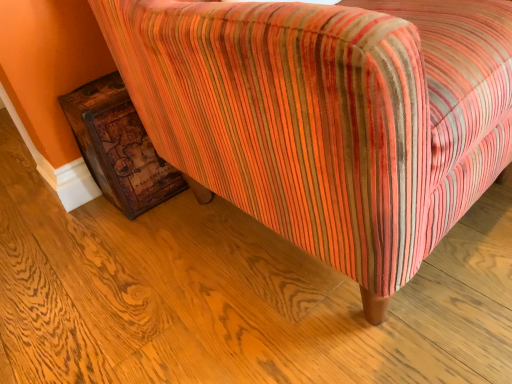
Question: From a real-world perspective, does distressed wood trunk at lower left stand above striped fabric chair at lower right?

Choices:
 (A) yes
 (B) no

Answer: (B)

Question: Considering the relative positions of distressed wood trunk at lower left and striped fabric chair at lower right in the image provided, is distressed wood trunk at lower left in front of striped fabric chair at lower right?

Choices:
 (A) yes
 (B) no

Answer: (B)

Question: Is the depth of distressed wood trunk at lower left greater than that of striped fabric chair at lower right?

Choices:
 (A) yes
 (B) no

Answer: (A)

Question: Considering the relative positions of distressed wood trunk at lower left and striped fabric chair at lower right in the image provided, is distressed wood trunk at lower left to the left of striped fabric chair at lower right from the viewer's perspective?

Choices:
 (A) no
 (B) yes

Answer: (B)

Question: Can you confirm if distressed wood trunk at lower left is thinner than striped fabric chair at lower right?

Choices:
 (A) no
 (B) yes

Answer: (B)

Question: From the image's perspective, is distressed wood trunk at lower left beneath striped fabric chair at lower right?

Choices:
 (A) no
 (B) yes

Answer: (B)

Question: Is striped fabric chair at lower right to the left of distressed wood trunk at lower left from the viewer's perspective?

Choices:
 (A) no
 (B) yes

Answer: (A)

Question: Is distressed wood trunk at lower left at the back of striped fabric chair at lower right?

Choices:
 (A) no
 (B) yes

Answer: (A)

Question: Is striped fabric chair at lower right beside distressed wood trunk at lower left?

Choices:
 (A) no
 (B) yes

Answer: (A)

Question: Is striped fabric chair at lower right facing towards distressed wood trunk at lower left?

Choices:
 (A) no
 (B) yes

Answer: (A)

Question: From a real-world perspective, is striped fabric chair at lower right located beneath distressed wood trunk at lower left?

Choices:
 (A) yes
 (B) no

Answer: (B)

Question: Is distressed wood trunk at lower left completely or partially inside striped fabric chair at lower right?

Choices:
 (A) yes
 (B) no

Answer: (A)

Question: Is distressed wood trunk at lower left taller or shorter than striped fabric chair at lower right?

Choices:
 (A) short
 (B) tall

Answer: (A)